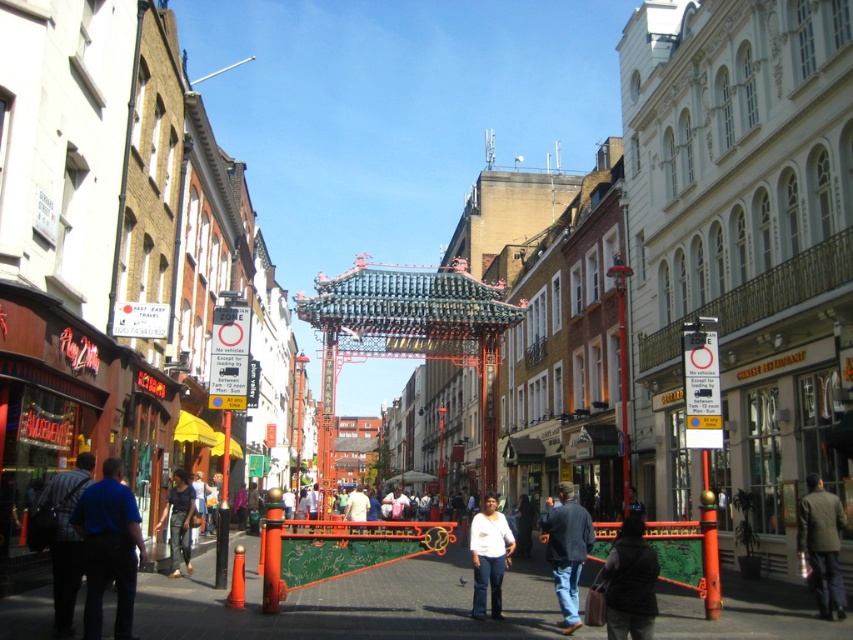
You are standing on the street in front of the red and green gate archway. There are two points marked on the ground in front of you. One is at coordinate point (601, 577) and the other is at point (190, 572). Which point is closer to you?

Point (601, 577) is closer to the viewer than point (190, 572).